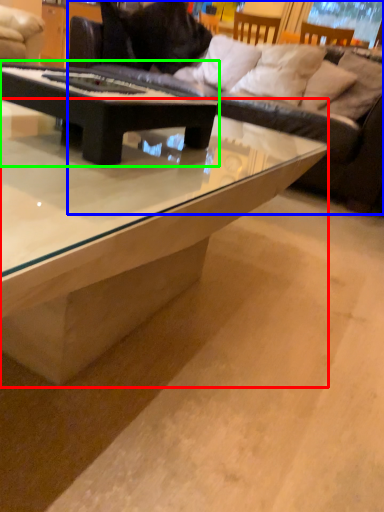
Question: Considering the real-world distances, which object is closest to coffee table (highlighted by a red box)? studio couch (highlighted by a blue box) or coffee table (highlighted by a green box).

Choices:
 (A) studio couch
 (B) coffee table

Answer: (B)